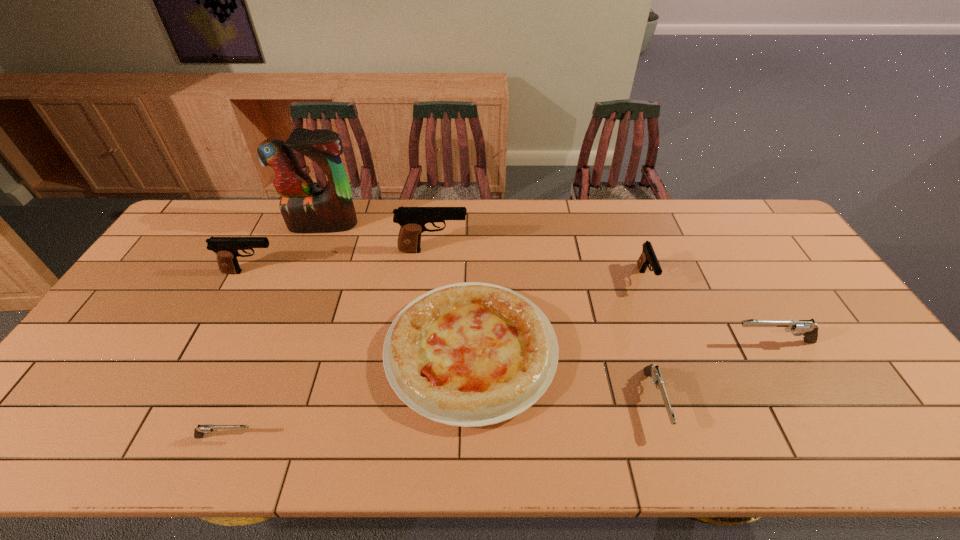
In the image, there is a desktop. Identify the location of free space at the right edge. The image size is (960, 540). (837, 344).

The image size is (960, 540). In order to click on free space at the far left corner of the desktop in this screenshot , I will do `click(243, 200)`.

Where is `free spot between the second biggest black pistol and the pizza`? The width and height of the screenshot is (960, 540). free spot between the second biggest black pistol and the pizza is located at coordinates (361, 312).

This screenshot has width=960, height=540. I want to click on vacant area between the biggest black pistol and the biggest silver pistol, so click(603, 296).

Identify the location of unoccupied position between the seventh object from left to right and the third pistol from left to right. (539, 265).

Identify the location of vacant point located between the second smallest black pistol and the farthest object. (287, 248).

At what (x,y) coordinates should I click in order to perform the action: click on vacant space in between the tallest pistol and the sixth shortest object. Please return your answer as a coordinate pair (x, y). This screenshot has width=960, height=540. Looking at the image, I should click on (343, 261).

Image resolution: width=960 pixels, height=540 pixels. Identify the location of free spot between the leftmost black pistol and the pizza. (361, 312).

Locate which object is the fifth closest to the second silver pistol from right to left. Please provide its 2D coordinates. Your answer should be formatted as a tuple, i.e. [(x, y)], where the tuple contains the x and y coordinates of a point satisfying the conditions above.

[(199, 431)]

Locate which object is the closest to the fifth tallest object. Please provide its 2D coordinates. Your answer should be formatted as a tuple, i.e. [(x, y)], where the tuple contains the x and y coordinates of a point satisfying the conditions above.

[(648, 256)]